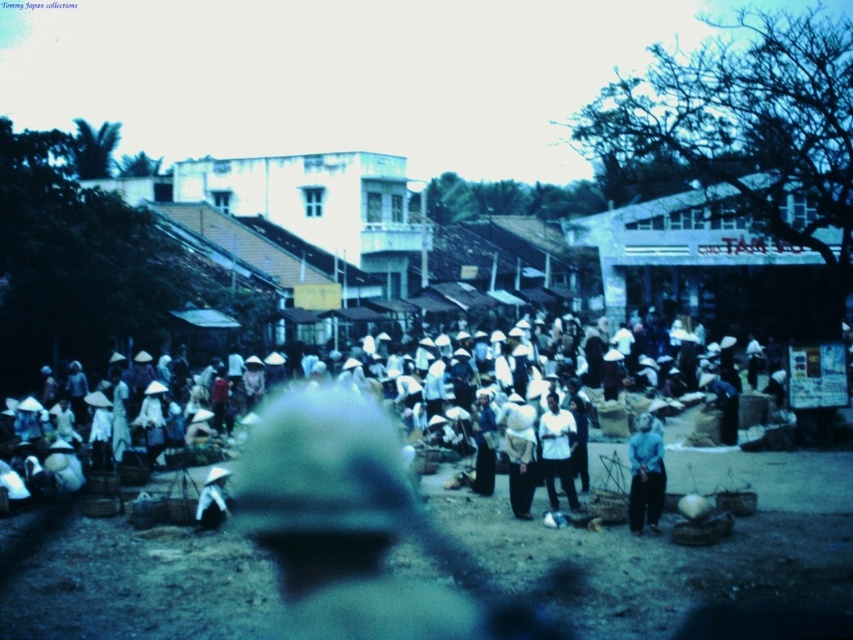
Question: From the image, what is the correct spatial relationship of white woven hat at center in relation to white fabric at center?

Choices:
 (A) right
 (B) left

Answer: (A)

Question: Is white woven hat at center to the left of white matte shirt at center from the viewer's perspective?

Choices:
 (A) no
 (B) yes

Answer: (A)

Question: Which of the following is the closest to the observer?

Choices:
 (A) (650, 486)
 (B) (579, 508)
 (C) (224, 500)

Answer: (A)

Question: Among these points, which one is farthest from the camera?

Choices:
 (A) (532, 419)
 (B) (213, 528)
 (C) (650, 513)
 (D) (572, 420)

Answer: (A)

Question: Is white matte shirt at center closer to the viewer compared to white straw hat at center?

Choices:
 (A) yes
 (B) no

Answer: (B)

Question: Which point is farther to the camera?

Choices:
 (A) white straw hat at center
 (B) white fabric at center

Answer: (B)